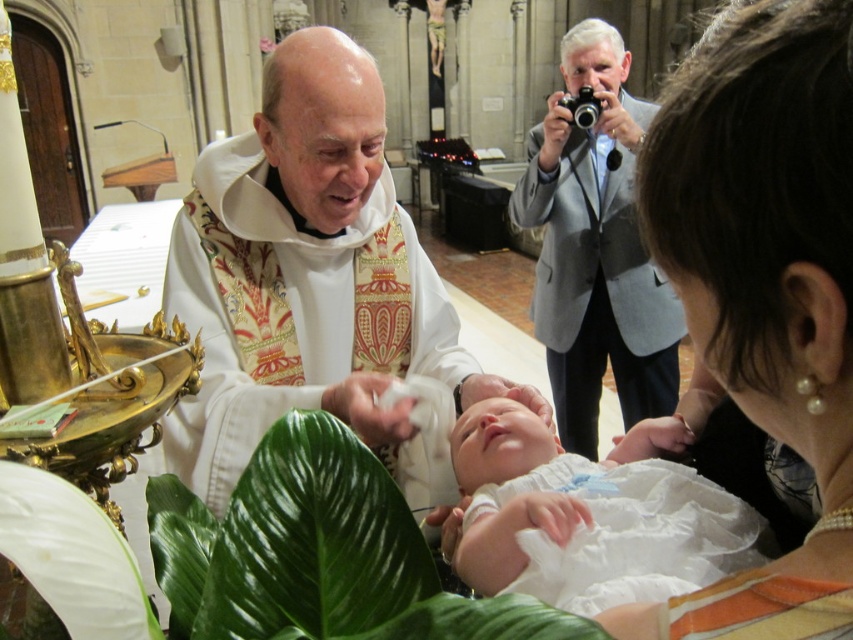
Question: Considering the relative positions of pearl earrings at upper right and white clothed newborn at center in the image provided, where is pearl earrings at upper right located with respect to white clothed newborn at center?

Choices:
 (A) below
 (B) above

Answer: (B)

Question: Based on their relative distances, which object is nearer to the white clothed newborn at center?

Choices:
 (A) pearl earrings at upper right
 (B) gray fabric jacket at upper right
 (C) white silk vestment at center

Answer: (C)

Question: Which of these objects is positioned closest to the pearl earrings at upper right?

Choices:
 (A) gray fabric jacket at upper right
 (B) white clothed newborn at center

Answer: (B)

Question: Is pearl earrings at upper right positioned behind white clothed newborn at center?

Choices:
 (A) no
 (B) yes

Answer: (A)

Question: Based on their relative distances, which object is farther from the white clothed newborn at center?

Choices:
 (A) gray fabric jacket at upper right
 (B) pearl earrings at upper right
 (C) white silk vestment at center

Answer: (A)

Question: Is pearl earrings at upper right smaller than white silk vestment at center?

Choices:
 (A) yes
 (B) no

Answer: (A)